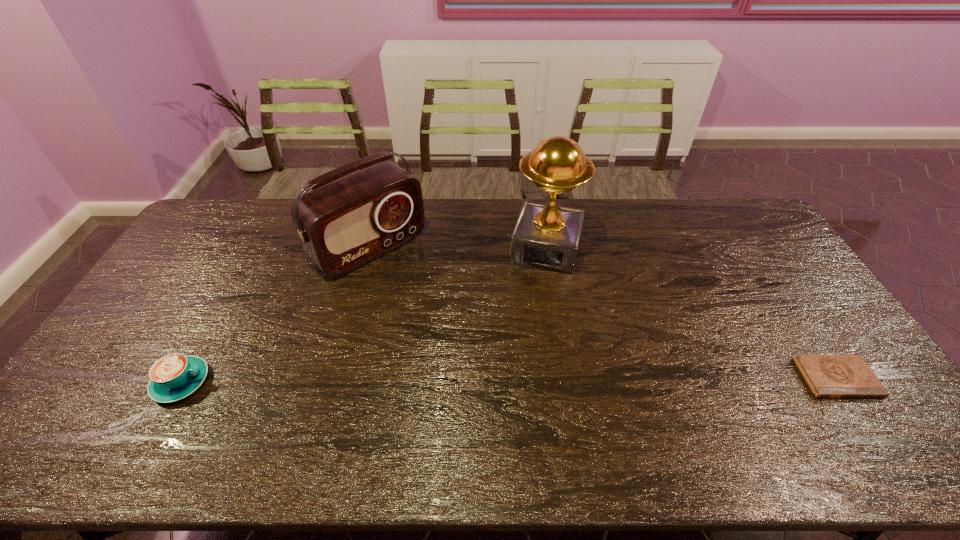
Where is `free space located on the front-facing side of the tallest object`? free space located on the front-facing side of the tallest object is located at coordinates (517, 357).

Identify the location of vacant space located 0.200m on the front-facing side of the tallest object. This screenshot has height=540, width=960. (527, 320).

This screenshot has width=960, height=540. Identify the location of vacant space located 0.130m on the front panel of the second object from left to right. (425, 298).

Identify the location of vacant space located on the front panel of the second object from left to right. The image size is (960, 540). (471, 340).

You are a GUI agent. You are given a task and a screenshot of the screen. Output one action in this format:
    pyautogui.click(x=<x>, y=<y>)
    Task: Click on the vacant space located 0.080m on the front panel of the second object from left to right
    
    Given the screenshot: What is the action you would take?
    pyautogui.click(x=416, y=289)

The height and width of the screenshot is (540, 960). I want to click on award at the far edge, so click(546, 236).

This screenshot has width=960, height=540. I want to click on radio receiver situated at the far edge, so click(x=343, y=224).

This screenshot has height=540, width=960. Identify the location of cappuccino located in the near edge section of the desktop. (175, 376).

Identify the location of diary that is at the near edge. The width and height of the screenshot is (960, 540). (828, 376).

Find the location of a particular element. object that is at the right edge is located at coordinates (828, 376).